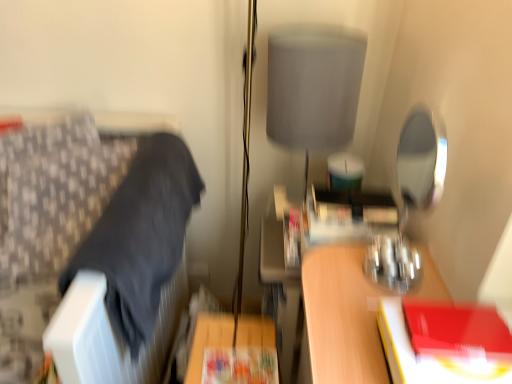
Question: Is patterned fabric cushion at left surrounding matte paper paperback book at center, which is the second paperback book in top-to-bottom order?

Choices:
 (A) no
 (B) yes

Answer: (A)

Question: From a real-world perspective, does patterned fabric cushion at left stand above matte paper paperback book at center, which is the second paperback book in top-to-bottom order?

Choices:
 (A) no
 (B) yes

Answer: (B)

Question: Is patterned fabric cushion at left to the left of matte paper paperback book at center, the 2th paperback book viewed from the front, from the viewer's perspective?

Choices:
 (A) no
 (B) yes

Answer: (B)

Question: Is patterned fabric cushion at left closer to the viewer compared to matte paper paperback book at center, the 1th paperback book viewed from the back?

Choices:
 (A) yes
 (B) no

Answer: (A)

Question: Is patterned fabric cushion at left facing towards matte paper paperback book at center, which is the second paperback book in top-to-bottom order?

Choices:
 (A) yes
 (B) no

Answer: (B)

Question: Does point (110, 145) appear closer or farther from the camera than point (459, 382)?

Choices:
 (A) farther
 (B) closer

Answer: (A)

Question: Is patterned fabric cushion at left to the left or to the right of red matte book at right, the 1th paperback book from the top, in the image?

Choices:
 (A) right
 (B) left

Answer: (B)

Question: From the image's perspective, is patterned fabric cushion at left above or below red matte book at right, the 1th paperback book from the top?

Choices:
 (A) above
 (B) below

Answer: (A)

Question: Relative to red matte book at right, which is the second paperback book in bottom-to-top order, is patterned fabric cushion at left in front or behind?

Choices:
 (A) front
 (B) behind

Answer: (B)

Question: In the image, is gray fabric lampshade at upper center on the left side or the right side of patterned fabric cushion at left?

Choices:
 (A) left
 (B) right

Answer: (B)

Question: From the image's perspective, is gray fabric lampshade at upper center positioned above or below patterned fabric cushion at left?

Choices:
 (A) below
 (B) above

Answer: (B)

Question: Is gray fabric lampshade at upper center situated inside patterned fabric cushion at left or outside?

Choices:
 (A) outside
 (B) inside

Answer: (A)

Question: Based on their sizes in the image, would you say gray fabric lampshade at upper center is bigger or smaller than patterned fabric cushion at left?

Choices:
 (A) big
 (B) small

Answer: (B)

Question: Considering their positions, is gray fabric lampshade at upper center located in front of or behind matte paper paperback book at center, positioned as the first paperback book in left-to-right order?

Choices:
 (A) front
 (B) behind

Answer: (B)

Question: Looking at the image, does gray fabric lampshade at upper center seem bigger or smaller compared to matte paper paperback book at center, the 2th paperback book viewed from the front?

Choices:
 (A) big
 (B) small

Answer: (A)